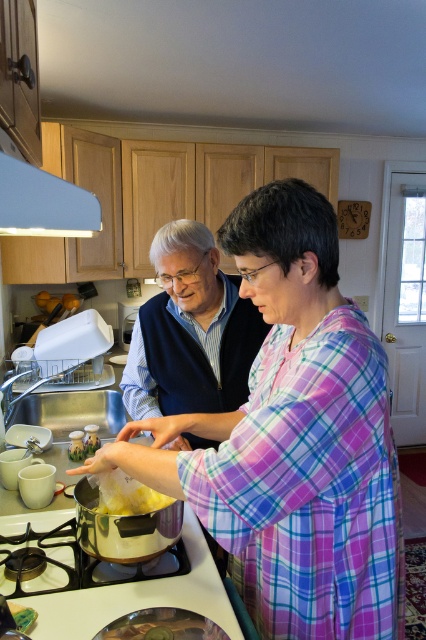
Question: Which point is closer to the camera?

Choices:
 (A) stainless steel pot at lower center
 (B) yellow matte food at center

Answer: (A)

Question: Does blue cotton vest at center lie in front of yellow matte food at center?

Choices:
 (A) yes
 (B) no

Answer: (B)

Question: Can you confirm if blue cotton vest at center is smaller than white matte exhaust hood at upper left?

Choices:
 (A) no
 (B) yes

Answer: (A)

Question: Which point is farther to the camera?

Choices:
 (A) (0, 195)
 (B) (124, 477)

Answer: (B)

Question: In this image, where is stainless steel pot at lower center located relative to yellow matte food at center?

Choices:
 (A) below
 (B) above

Answer: (A)

Question: Which point is farther to the camera?

Choices:
 (A) (143, 486)
 (B) (164, 593)
 (C) (215, 275)

Answer: (C)